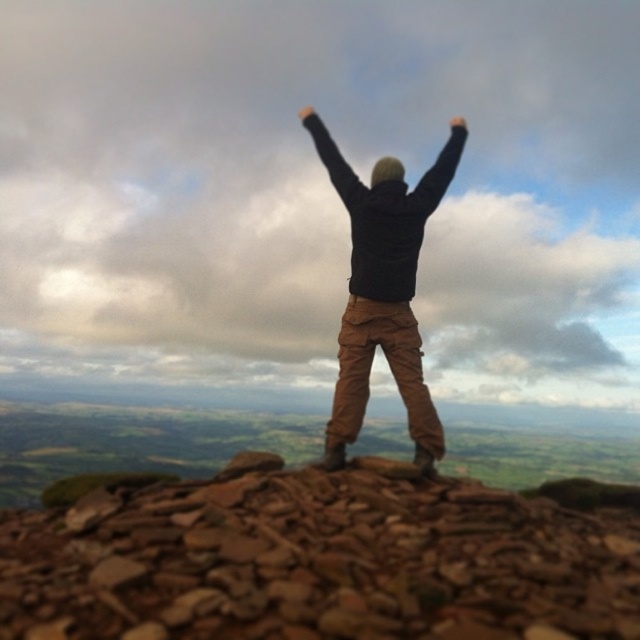
Question: Does brown rough rocks at center appear under black matte jacket at center?

Choices:
 (A) no
 (B) yes

Answer: (B)

Question: Where is black matte jacket at center located in relation to black matte hand at upper center in the image?

Choices:
 (A) above
 (B) below

Answer: (B)

Question: Which of the following is the closest to the observer?

Choices:
 (A) brown rough rocks at center
 (B) black matte jacket at center

Answer: (A)

Question: Which point is farther to the camera?

Choices:
 (A) (134, 516)
 (B) (428, 468)
 (C) (308, 106)

Answer: (C)

Question: Estimate the real-world distances between objects in this image. Which object is closer to the brown rough rocks at center?

Choices:
 (A) black matte jacket at center
 (B) black matte hand at upper center

Answer: (A)

Question: Does brown rough rocks at center appear under black matte jacket at center?

Choices:
 (A) no
 (B) yes

Answer: (B)